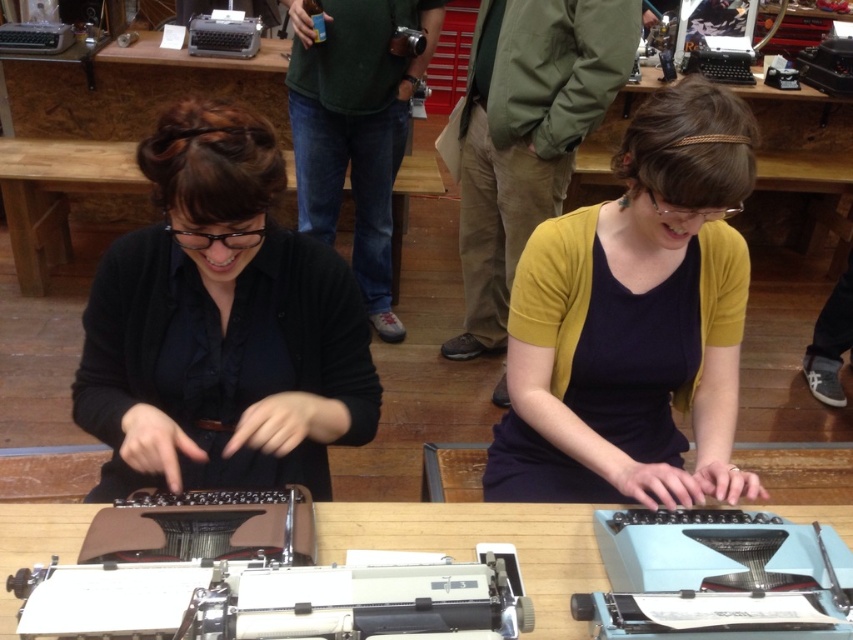
How much distance is there between mustard yellow cardigan at center and white plastic typewriter at center?

mustard yellow cardigan at center is 14.39 inches away from white plastic typewriter at center.

The width and height of the screenshot is (853, 640). Describe the element at coordinates (634, 321) in the screenshot. I see `mustard yellow cardigan at center` at that location.

What do you see at coordinates (634, 321) in the screenshot? This screenshot has height=640, width=853. I see `mustard yellow cardigan at center` at bounding box center [634, 321].

The image size is (853, 640). What are the coordinates of `mustard yellow cardigan at center` in the screenshot? It's located at (634, 321).

Based on the photo, can you confirm if green fabric shirt at center is positioned to the right of white plastic typewriter at center?

No, green fabric shirt at center is not to the right of white plastic typewriter at center.

Which is behind, point (337, 36) or point (6, 541)?

Point (337, 36)

Does point (376, 289) lie behind point (560, 538)?

Yes, point (376, 289) is farther from viewer.

Find the location of a particular element. green fabric shirt at center is located at coordinates (355, 128).

Looking at this image, who is shorter, green fabric shirt at center or wooden table at center?

wooden table at center

Which is below, green fabric shirt at center or wooden table at center?

green fabric shirt at center is below.

Find the location of a particular element. This screenshot has width=853, height=640. green fabric shirt at center is located at coordinates (355, 128).